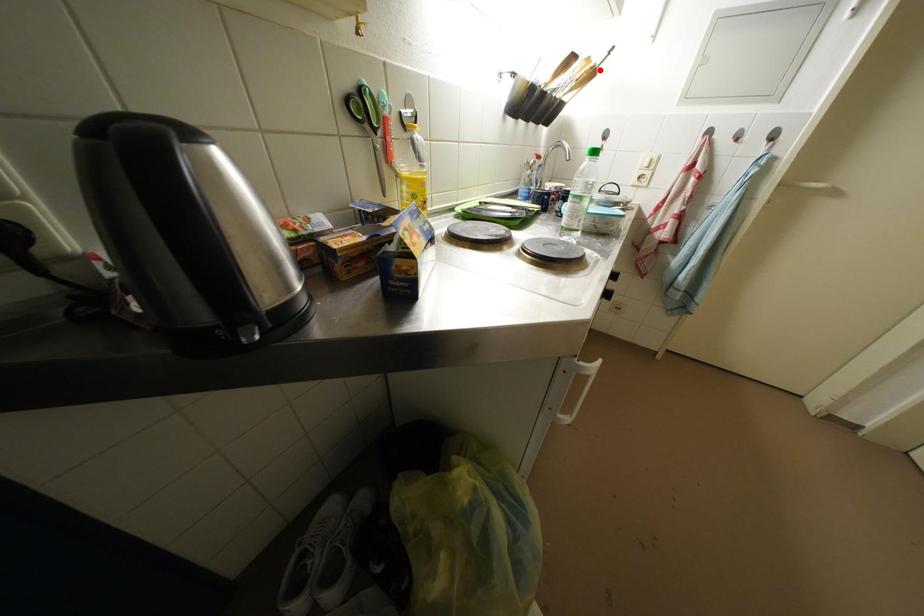
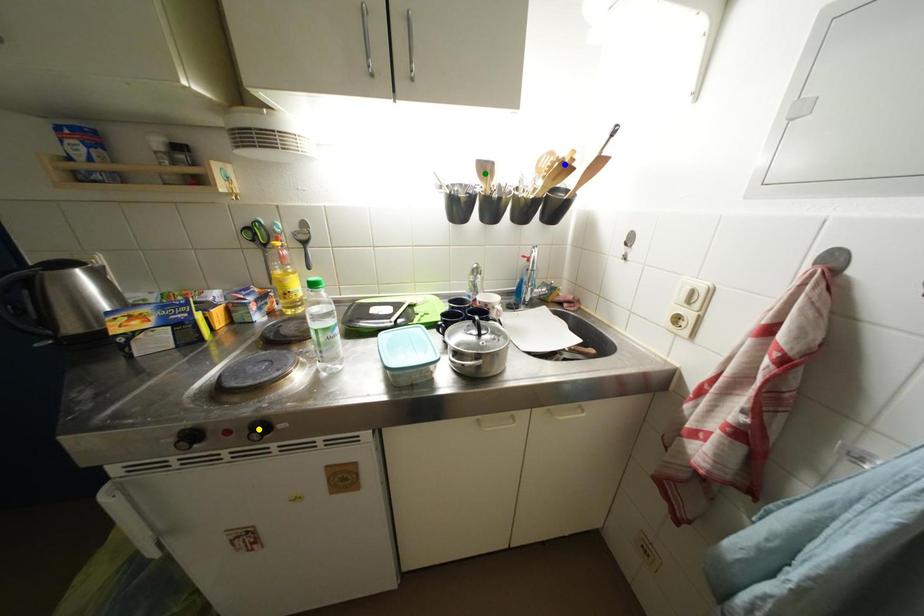
Question: I am providing you with two images of the same scene from different viewpoints. A red point is marked on the first image. You are given multiple points on the second image. Which point in image 2 represents the same 3d spot as the red point in image 1?

Choices:
 (A) yellow point
 (B) green point
 (C) blue point

Answer: (C)